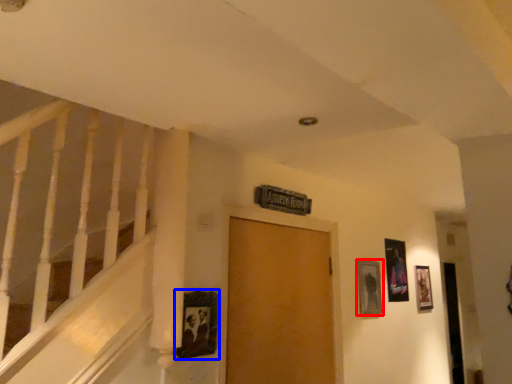
Question: Which object appears closest to the camera in this image, picture frame (highlighted by a red box) or picture frame (highlighted by a blue box)?

Choices:
 (A) picture frame
 (B) picture frame

Answer: (B)